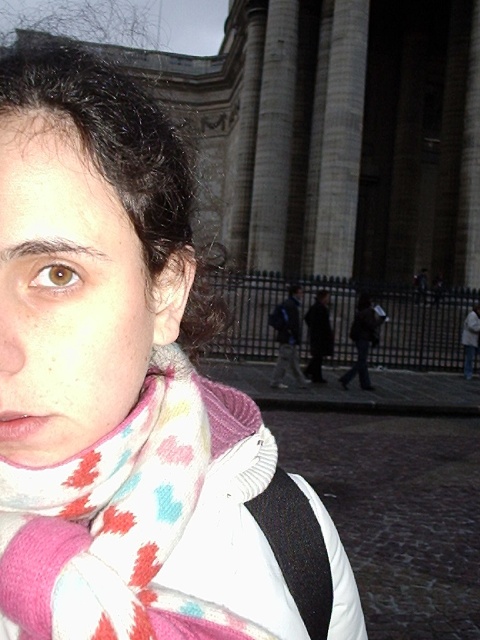
You are a photographer trying to capture the person in the image. You want to focus on the blue backpack at center without the white and multicolored scarf at center blocking it. Based on their positions, is the scarf likely to be visible in the shot if you aim directly at the backpack?

The white and multicolored scarf at center is located below the blue backpack at center, so if you aim directly at the backpack, the scarf will be below it and may still be visible in the shot depending on the camera angle and lens used.

You are a photographer trying to capture the person in the image. If you want to focus on the white and multicolored scarf at center without the blue backpack at center being in the way, which object should you adjust your camera angle to move closer to?

The white and multicolored scarf at center is in front of the blue backpack at center, so adjusting the camera angle towards the scarf would allow focusing on it while the backpack remains behind and out of the way.

You are a photographer trying to capture the blue backpack at center and the white and multicolored scarf at center in the same frame. Given that the distance between them is significant, do you think you can fit both into your camera viewfinder without moving your position?

The white and multicolored scarf at center is 31.71 meters from the blue backpack at center, so the distance between them is too large to fit both into the camera viewfinder without moving your position.